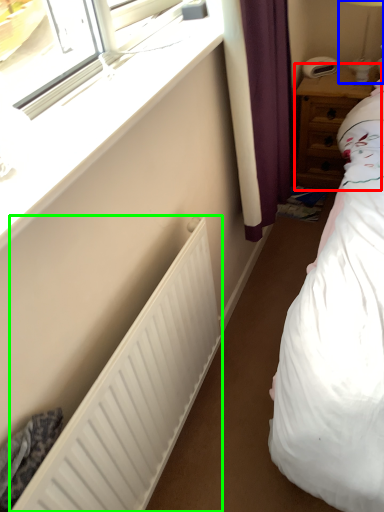
Question: Estimate the real-world distances between objects in this image. Which object is closer to nightstand (highlighted by a red box), bedside lamp (highlighted by a blue box) or radiator (highlighted by a green box)?

Choices:
 (A) bedside lamp
 (B) radiator

Answer: (A)